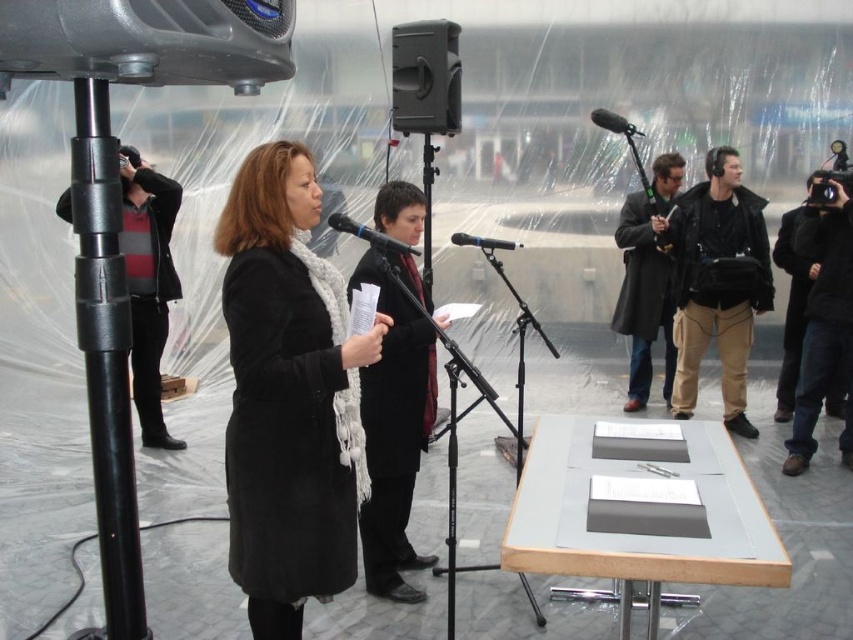
Question: In this image, where is black wool coat at center located relative to black matte microphone at center?

Choices:
 (A) below
 (B) above

Answer: (A)

Question: Can you confirm if black wool coat at center is positioned to the right of black matte microphone at upper center?

Choices:
 (A) yes
 (B) no

Answer: (B)

Question: Is black leather jacket at right below dark gray coat at right?

Choices:
 (A) yes
 (B) no

Answer: (A)

Question: Which point appears farthest from the camera in this image?

Choices:
 (A) (332, 582)
 (B) (592, 118)

Answer: (B)

Question: Which point is closer to the camera?

Choices:
 (A) (643, 211)
 (B) (387, 228)
 (C) (340, 212)
 (D) (334, 442)

Answer: (D)

Question: Among these objects, which one is nearest to the camera?

Choices:
 (A) matte black coat at center
 (B) black metallic microphone at center

Answer: (A)